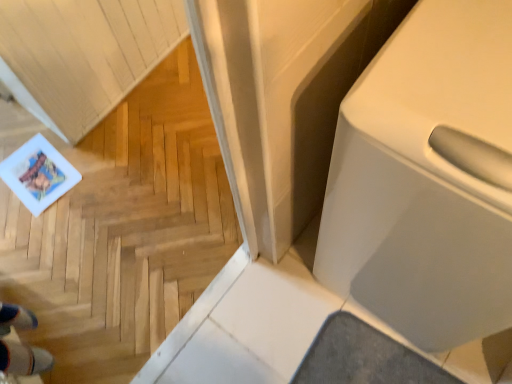
Question: Is light wood parquet floor at lower left not close to white glossy toilet at right?

Choices:
 (A) no
 (B) yes

Answer: (A)

Question: Is light wood parquet floor at lower left facing away from white glossy toilet at right?

Choices:
 (A) no
 (B) yes

Answer: (A)

Question: From a real-world perspective, is light wood parquet floor at lower left under white glossy toilet at right?

Choices:
 (A) yes
 (B) no

Answer: (B)

Question: Can you confirm if light wood parquet floor at lower left is wider than white glossy toilet at right?

Choices:
 (A) yes
 (B) no

Answer: (B)

Question: Is light wood parquet floor at lower left oriented towards white glossy toilet at right?

Choices:
 (A) no
 (B) yes

Answer: (A)

Question: From a real-world perspective, is light wood parquet floor at lower left physically above white glossy toilet at right?

Choices:
 (A) no
 (B) yes

Answer: (B)

Question: Is white glossy toilet at right at the left side of light wood parquet floor at lower left?

Choices:
 (A) yes
 (B) no

Answer: (B)

Question: Can you confirm if white glossy toilet at right is shorter than light wood parquet floor at lower left?

Choices:
 (A) yes
 (B) no

Answer: (A)

Question: Is the position of white glossy toilet at right more distant than that of light wood parquet floor at lower left?

Choices:
 (A) yes
 (B) no

Answer: (A)

Question: Considering the relative sizes of white glossy toilet at right and light wood parquet floor at lower left in the image provided, is white glossy toilet at right thinner than light wood parquet floor at lower left?

Choices:
 (A) no
 (B) yes

Answer: (A)

Question: From a real-world perspective, is white glossy toilet at right on light wood parquet floor at lower left?

Choices:
 (A) no
 (B) yes

Answer: (A)

Question: Considering the relative sizes of white glossy toilet at right and light wood parquet floor at lower left in the image provided, is white glossy toilet at right bigger than light wood parquet floor at lower left?

Choices:
 (A) yes
 (B) no

Answer: (A)

Question: Relative to light wood parquet floor at lower left, is white glossy toilet at right in front or behind?

Choices:
 (A) behind
 (B) front

Answer: (A)